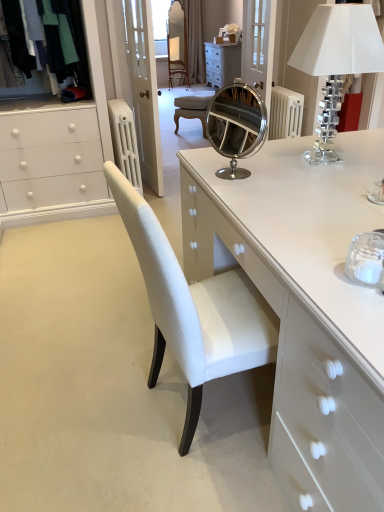
Question: Can you confirm if white painted metal radiator at upper left is shorter than white glossy chest of drawers at center?

Choices:
 (A) no
 (B) yes

Answer: (A)

Question: From a real-world perspective, is white painted metal radiator at upper left positioned under white glossy chest of drawers at center based on gravity?

Choices:
 (A) no
 (B) yes

Answer: (A)

Question: Does white painted metal radiator at upper left have a lesser width compared to white glossy chest of drawers at center?

Choices:
 (A) yes
 (B) no

Answer: (A)

Question: Is white painted metal radiator at upper left completely or partially outside of white glossy chest of drawers at center?

Choices:
 (A) no
 (B) yes

Answer: (B)

Question: Is white painted metal radiator at upper left in contact with white glossy chest of drawers at center?

Choices:
 (A) yes
 (B) no

Answer: (B)

Question: Does white painted metal radiator at upper left have a smaller size compared to white glossy chest of drawers at center?

Choices:
 (A) yes
 (B) no

Answer: (A)

Question: Does clear glass door at upper center appear on the left side of velvet fabric clothes at upper left?

Choices:
 (A) no
 (B) yes

Answer: (A)

Question: From a real-world perspective, is clear glass door at upper center on velvet fabric clothes at upper left?

Choices:
 (A) yes
 (B) no

Answer: (B)

Question: From a real-world perspective, does clear glass door at upper center sit lower than velvet fabric clothes at upper left?

Choices:
 (A) yes
 (B) no

Answer: (A)

Question: Is clear glass door at upper center oriented towards velvet fabric clothes at upper left?

Choices:
 (A) no
 (B) yes

Answer: (B)

Question: Is clear glass door at upper center positioned in front of velvet fabric clothes at upper left?

Choices:
 (A) no
 (B) yes

Answer: (A)

Question: Does clear glass door at upper center come behind velvet fabric clothes at upper left?

Choices:
 (A) no
 (B) yes

Answer: (B)

Question: Does white glossy chest of drawers at center have a lesser width compared to clear glass door at upper center?

Choices:
 (A) yes
 (B) no

Answer: (B)